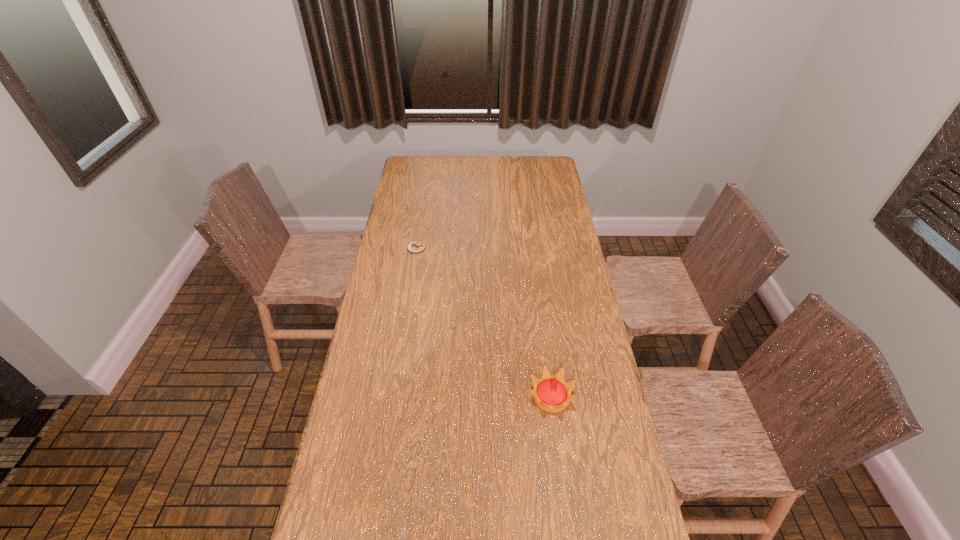
At what (x,y) coordinates should I click in order to perform the action: click on the nearer object. Please return your answer as a coordinate pair (x, y). Looking at the image, I should click on (552, 394).

This screenshot has height=540, width=960. Find the location of `the right object`. the right object is located at coordinates (552, 394).

The image size is (960, 540). What are the coordinates of `patty` in the screenshot? It's located at (416, 246).

This screenshot has height=540, width=960. Find the location of `the farther object`. the farther object is located at coordinates (416, 246).

I want to click on vacant space situated on the front of the taller object, so click(564, 496).

The image size is (960, 540). Identify the location of free region located 0.110m on the front of the farther object. (413, 271).

This screenshot has width=960, height=540. Identify the location of object that is at the left edge. (416, 246).

At what (x,y) coordinates should I click in order to perform the action: click on object situated at the right edge. Please return your answer as a coordinate pair (x, y). Image resolution: width=960 pixels, height=540 pixels. Looking at the image, I should click on (552, 394).

Find the location of `blank space at the far edge`. blank space at the far edge is located at coordinates (523, 168).

Locate an element on the screen. vacant region at the left edge of the desktop is located at coordinates (348, 455).